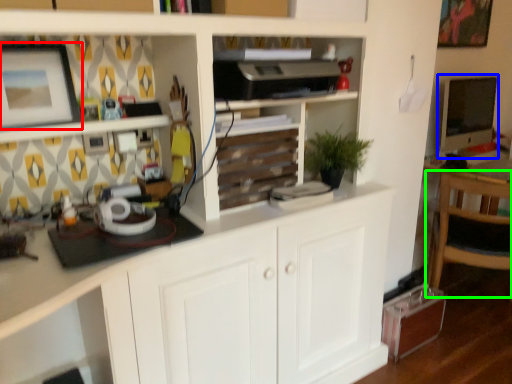
Question: Which object is positioned farthest from picture frame (highlighted by a red box)? Select from computer monitor (highlighted by a blue box) and chair (highlighted by a green box).

Choices:
 (A) computer monitor
 (B) chair

Answer: (A)